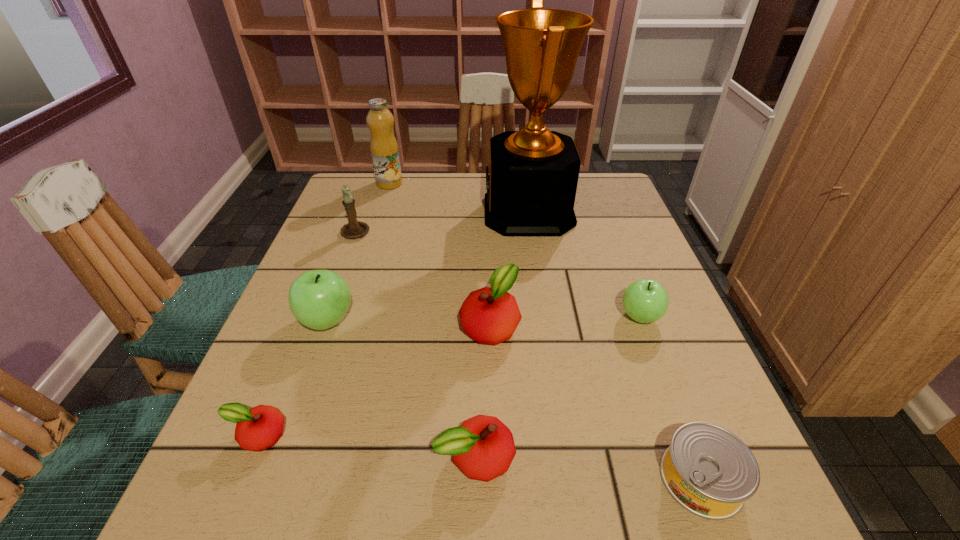
Where is `free space at the left edge of the desktop`? free space at the left edge of the desktop is located at coordinates (248, 391).

The width and height of the screenshot is (960, 540). I want to click on free location at the right edge, so click(x=609, y=280).

The image size is (960, 540). In the image, there is a desktop. What are the coordinates of `vacant space at the near left corner` in the screenshot? It's located at (250, 511).

In the image, there is a desktop. Find the location of `vacant space at the far right corner`. vacant space at the far right corner is located at coordinates pos(615,190).

The image size is (960, 540). In order to click on empty space that is in between the second tallest object and the candle holder in this screenshot , I will do `click(372, 207)`.

Image resolution: width=960 pixels, height=540 pixels. Identify the location of vacant area that lies between the fruit juice and the second biggest red apple. (433, 320).

This screenshot has width=960, height=540. Identify the location of free space between the second tallest object and the trophy cup. (459, 198).

Find the location of `free space between the tallest apple and the second biggest red apple`. free space between the tallest apple and the second biggest red apple is located at coordinates (401, 389).

Where is `free spot between the can and the tallest apple`? The width and height of the screenshot is (960, 540). free spot between the can and the tallest apple is located at coordinates (515, 399).

What are the coordinates of `vacant area that lies between the rightmost apple and the fruit juice` in the screenshot? It's located at (515, 250).